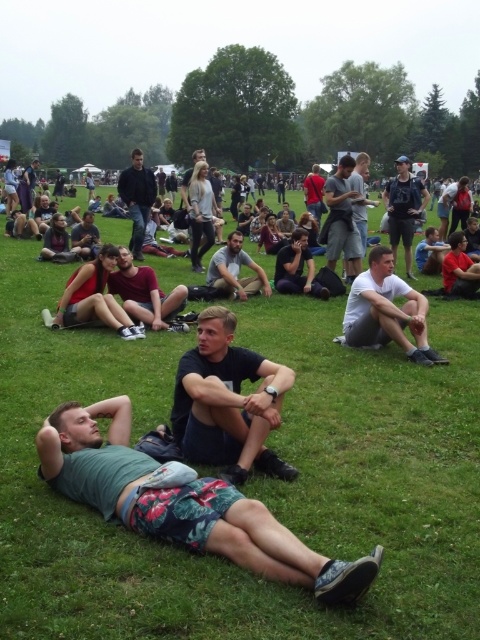
Who is positioned more to the right, white cotton shirt at center or dark gray t-shirt at center?

From the viewer's perspective, dark gray t-shirt at center appears more on the right side.

Is white cotton shirt at center further to camera compared to dark gray t-shirt at center?

No, it is in front of dark gray t-shirt at center.

The image size is (480, 640). In order to click on white cotton shirt at center in this screenshot , I will do `click(386, 310)`.

Can you confirm if dark gray casual pants at center is positioned above dark blue shirt at center?

No.

Between dark gray casual pants at center and dark blue shirt at center, which one appears on the right side from the viewer's perspective?

dark blue shirt at center

Locate an element on the screen. This screenshot has height=640, width=480. dark gray casual pants at center is located at coordinates (145, 294).

The height and width of the screenshot is (640, 480). What do you see at coordinates (182, 502) in the screenshot?
I see `green fabric shorts at lower center` at bounding box center [182, 502].

The image size is (480, 640). I want to click on green fabric shorts at lower center, so click(182, 502).

Between point (202, 531) and point (121, 257), which one is positioned in front?

Point (202, 531)

Image resolution: width=480 pixels, height=640 pixels. I want to click on green fabric shorts at lower center, so click(x=182, y=502).